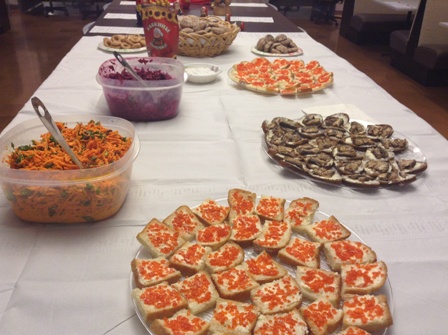
Identify the location of tupperware. (110, 204).